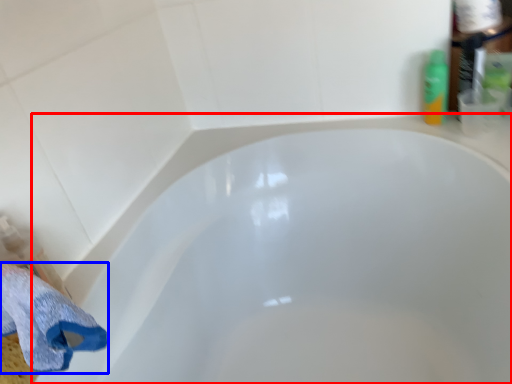
Question: Which object appears closest to the camera in this image, bathtub (highlighted by a red box) or bath towel (highlighted by a blue box)?

Choices:
 (A) bathtub
 (B) bath towel

Answer: (A)